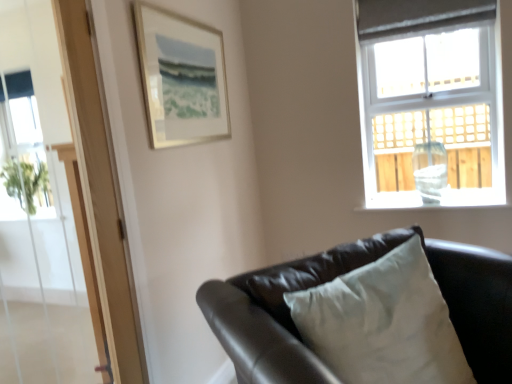
Image resolution: width=512 pixels, height=384 pixels. What do you see at coordinates (430, 170) in the screenshot?
I see `transparent glass vase at window` at bounding box center [430, 170].

Describe the element at coordinates (181, 78) in the screenshot. The width and height of the screenshot is (512, 384). I see `silver metallic picture frame at upper left` at that location.

What do you see at coordinates (429, 205) in the screenshot?
I see `white glass at upper right` at bounding box center [429, 205].

Image resolution: width=512 pixels, height=384 pixels. What do you see at coordinates (433, 113) in the screenshot?
I see `matte glass vase at upper right` at bounding box center [433, 113].

Identify the location of transparent glass screen door at upper left. (42, 215).

Does transparent glass vase at window lie in front of matte black couch at lower right?

No, transparent glass vase at window is further to the viewer.

Based on the photo, are transparent glass vase at window and matte black couch at lower right far apart?

That's right, there is a large distance between transparent glass vase at window and matte black couch at lower right.

Would you say matte black couch at lower right is part of transparent glass vase at window's contents?

No, matte black couch at lower right is not surrounded by transparent glass vase at window.

Image resolution: width=512 pixels, height=384 pixels. Identify the location of screen door located below the silver metallic picture frame at upper left (from the image's perspective). (42, 215).

Is silver metallic picture frame at upper left oriented towards transparent glass screen door at upper left?

No, silver metallic picture frame at upper left is not turned towards transparent glass screen door at upper left.

Is silver metallic picture frame at upper left thinner than transparent glass screen door at upper left?

Yes, silver metallic picture frame at upper left is thinner than transparent glass screen door at upper left.

Consider the image. Can you confirm if silver metallic picture frame at upper left is bigger than transparent glass screen door at upper left?

No, silver metallic picture frame at upper left is not bigger than transparent glass screen door at upper left.

You are a GUI agent. You are given a task and a screenshot of the screen. Output one action in this format:
    pyautogui.click(x=<x>, y=<y>)
    Task: Click on the window sill directly beneath the transparent glass vase at window (from a real-world perspective)
    The image size is (512, 384).
    Given the screenshot: What is the action you would take?
    pyautogui.click(x=429, y=205)

Is transparent glass vase at window aimed at white glass at upper right?

No, transparent glass vase at window does not turn towards white glass at upper right.

Does transparent glass vase at window have a lesser width compared to white glass at upper right?

Yes.

Does transparent glass screen door at upper left have a greater width compared to matte black couch at lower right?

In fact, transparent glass screen door at upper left might be narrower than matte black couch at lower right.

Consider the image. Which is closer to the camera, [2,100] or [242,297]?

Positioned in front is point [242,297].

From a real-world perspective, is transparent glass screen door at upper left positioned over matte black couch at lower right based on gravity?

Correct, in the physical world, transparent glass screen door at upper left is higher than matte black couch at lower right.

Who is smaller, transparent glass screen door at upper left or matte black couch at lower right?

transparent glass screen door at upper left is smaller.

Does clear glass door at left turn towards matte black couch at lower right?

No, clear glass door at left is not facing towards matte black couch at lower right.

Can you confirm if clear glass door at left is taller than matte black couch at lower right?

Yes.

Is the position of clear glass door at left more distant than that of matte black couch at lower right?

Yes, clear glass door at left is further from the viewer.

Is matte glass vase at upper right looking in the opposite direction of transparent glass vase at window?

Yes, matte glass vase at upper right is facing away from transparent glass vase at window.

Is the depth of matte glass vase at upper right less than that of transparent glass vase at window?

Yes, it is.

Which object is wider, matte glass vase at upper right or transparent glass vase at window?

matte glass vase at upper right is wider.

Looking at this image, considering the sizes of objects matte glass vase at upper right and transparent glass vase at window in the image provided, who is shorter, matte glass vase at upper right or transparent glass vase at window?

Standing shorter between the two is transparent glass vase at window.

Who is taller, matte glass vase at upper right or transparent glass screen door at upper left?

Result: transparent glass screen door at upper left is taller.

Can you tell me how much matte glass vase at upper right and transparent glass screen door at upper left differ in facing direction?

89.9 degrees.

Is matte glass vase at upper right looking in the opposite direction of transparent glass screen door at upper left?

No, matte glass vase at upper right's orientation is not away from transparent glass screen door at upper left.

Choose the correct answer: Is matte glass vase at upper right inside transparent glass screen door at upper left or outside it?

matte glass vase at upper right exists outside the volume of transparent glass screen door at upper left.

The image size is (512, 384). I want to click on studio couch below the transparent glass vase at window (from the image's perspective), so click(x=346, y=272).

You are a GUI agent. You are given a task and a screenshot of the screen. Output one action in this format:
    pyautogui.click(x=<x>, y=<y>)
    Task: Click on the screen door beneath the silver metallic picture frame at upper left (from a real-world perspective)
    This screenshot has height=384, width=512.
    Given the screenshot: What is the action you would take?
    pyautogui.click(x=42, y=215)

Which object lies further to the anchor point white glass at upper right, transparent glass screen door at upper left or transparent glass vase at window?

transparent glass screen door at upper left is positioned further to the anchor white glass at upper right.

Which object lies nearer to the anchor point matte glass vase at upper right, silver metallic picture frame at upper left or transparent glass screen door at upper left?

The object closer to matte glass vase at upper right is silver metallic picture frame at upper left.

Which object lies nearer to the anchor point matte glass vase at upper right, matte black couch at lower right or transparent glass vase at window?

Among the two, transparent glass vase at window is located nearer to matte glass vase at upper right.

Based on their spatial positions, is matte glass vase at upper right or matte black couch at lower right closer to silver metallic picture frame at upper left?

matte black couch at lower right lies closer to silver metallic picture frame at upper left than the other object.

Consider the image. From the image, which object appears to be nearer to matte glass vase at upper right, silver metallic picture frame at upper left or matte black couch at lower right?

silver metallic picture frame at upper left is closer to matte glass vase at upper right.

Looking at the image, which one is located closer to transparent glass screen door at upper left, matte black couch at lower right or matte glass vase at upper right?

matte black couch at lower right is positioned closer to the anchor transparent glass screen door at upper left.

Which object lies further to the anchor point matte glass vase at upper right, matte black couch at lower right or silver metallic picture frame at upper left?

matte black couch at lower right lies further to matte glass vase at upper right than the other object.

From the image, which object appears to be nearer to transparent glass screen door at upper left, white glass at upper right or clear glass door at left?

Based on the image, clear glass door at left appears to be nearer to transparent glass screen door at upper left.

Where is `screen door between clear glass door at left and matte glass vase at upper right in the horizontal direction`? This screenshot has height=384, width=512. screen door between clear glass door at left and matte glass vase at upper right in the horizontal direction is located at coordinates (42, 215).

Identify the location of window between clear glass door at left and transparent glass vase at window from left to right. (433, 113).

Where is `screen door between matte black couch at lower right and transparent glass vase at window from front to back`? Image resolution: width=512 pixels, height=384 pixels. screen door between matte black couch at lower right and transparent glass vase at window from front to back is located at coordinates (42, 215).

Where is `screen door located between matte black couch at lower right and clear glass door at left in the depth direction`? Image resolution: width=512 pixels, height=384 pixels. screen door located between matte black couch at lower right and clear glass door at left in the depth direction is located at coordinates (42, 215).